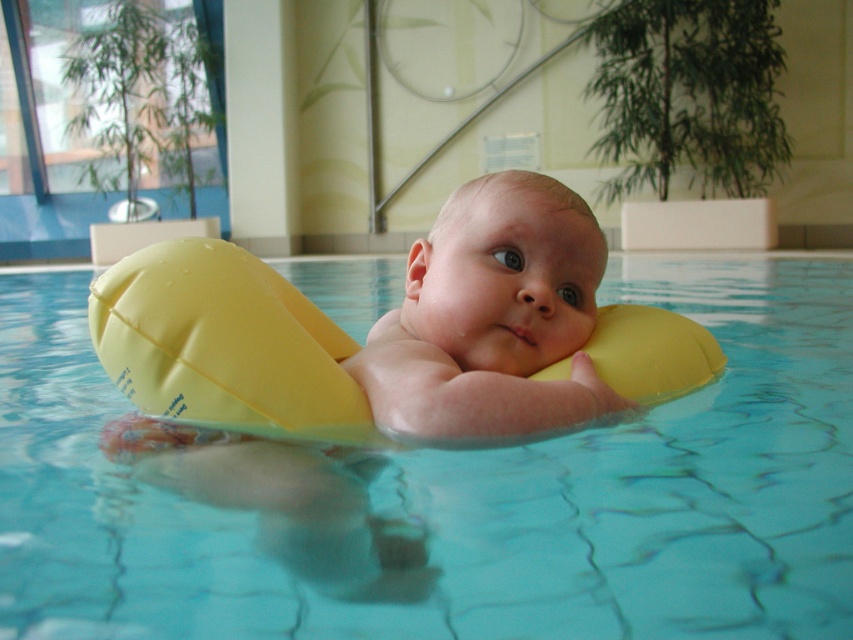
Question: Is transparent yellow float at center thinner than yellow rubber ring at center?

Choices:
 (A) no
 (B) yes

Answer: (A)

Question: Can you confirm if transparent yellow float at center is positioned to the right of yellow rubber ring at center?

Choices:
 (A) yes
 (B) no

Answer: (A)

Question: Which of the following is the closest to the observer?

Choices:
 (A) (560, 208)
 (B) (512, 554)

Answer: (B)

Question: Is transparent yellow float at center bigger than yellow rubber ring at center?

Choices:
 (A) yes
 (B) no

Answer: (A)